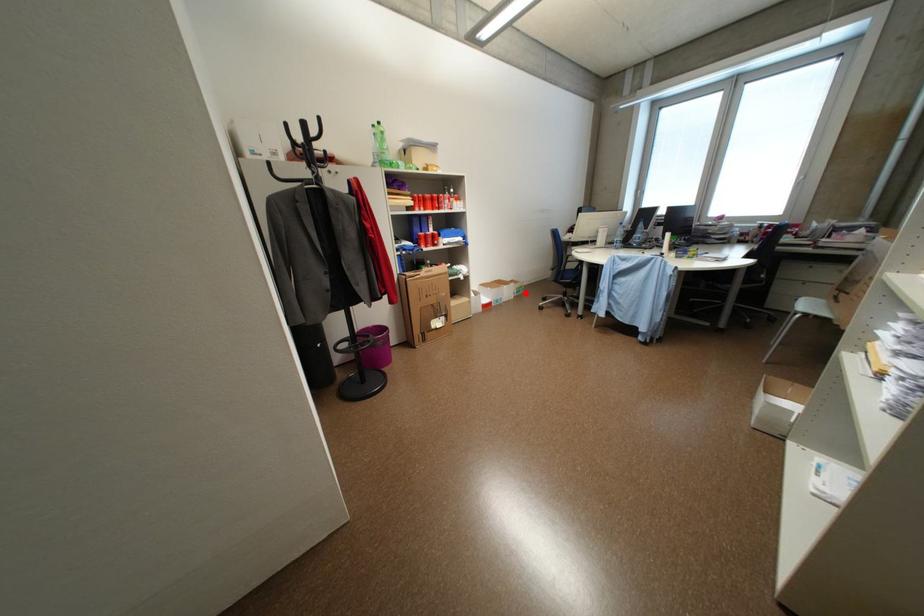
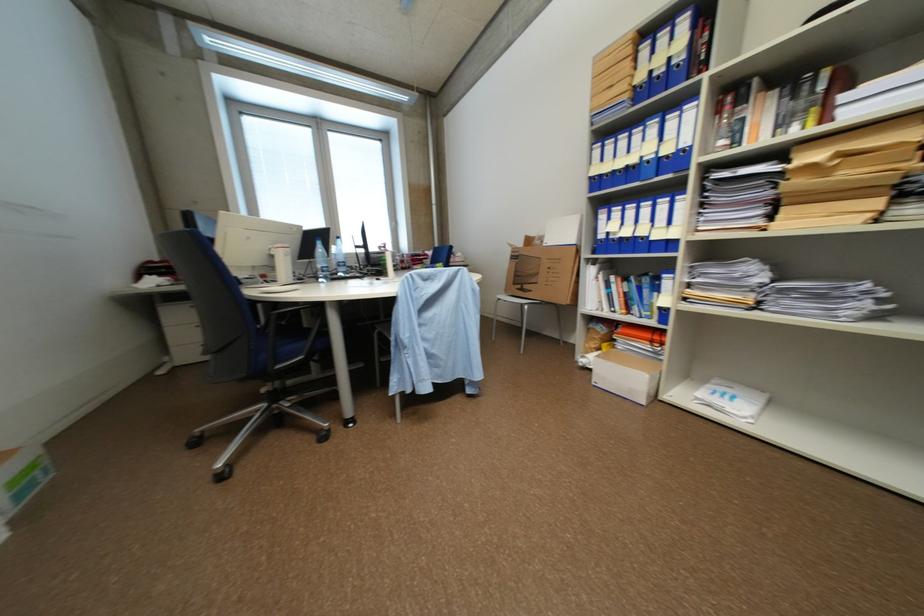
Question: I am providing you with two images of the same scene from different viewpoints. A red point is shown in image1. For the corresponding object point in image2, is it positioned nearer or farther from the camera?

Choices:
 (A) Nearer
 (B) Farther

Answer: (B)